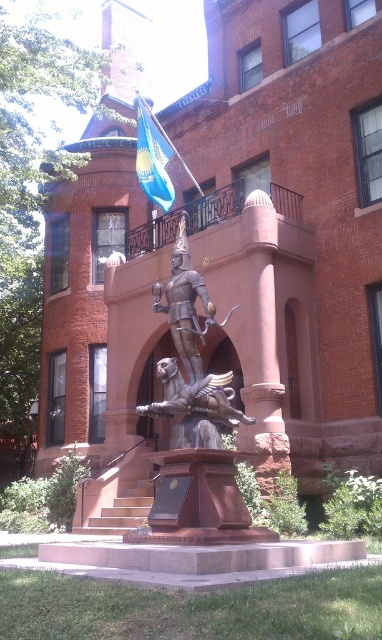
Question: Which object is farther from the camera taking this photo?

Choices:
 (A) polished bronze statue at center
 (B) bronze/golden statue at center
 (C) blue fabric flag at upper center

Answer: (C)

Question: Is polished bronze statue at center positioned before bronze/golden statue at center?

Choices:
 (A) no
 (B) yes

Answer: (A)

Question: Is polished bronze statue at center positioned at the back of bronze/golden statue at center?

Choices:
 (A) no
 (B) yes

Answer: (B)

Question: Which point is farther from the camera taking this photo?

Choices:
 (A) (174, 426)
 (B) (168, 189)
 (C) (153, 291)

Answer: (B)

Question: Which point is farther from the camera taking this photo?

Choices:
 (A) (152, 122)
 (B) (176, 388)

Answer: (A)

Question: Can you confirm if polished bronze statue at center is positioned to the right of blue fabric flag at upper center?

Choices:
 (A) no
 (B) yes

Answer: (B)